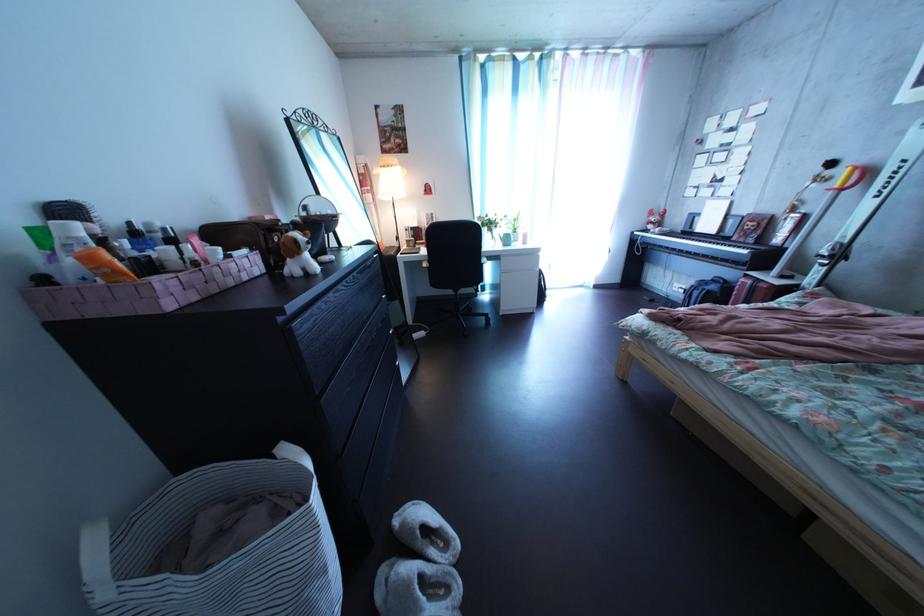
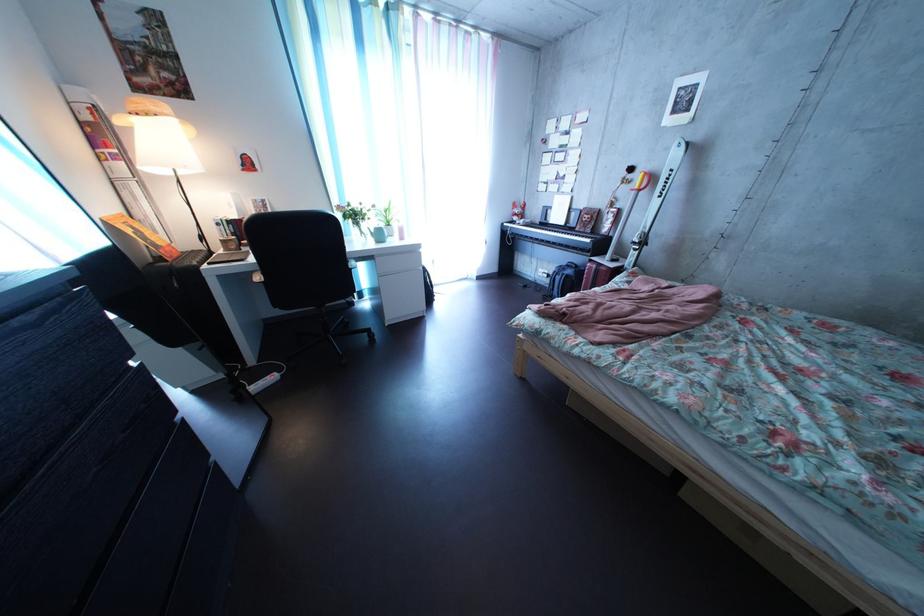
In the second image, find the point that corresponds to point (689, 293) in the first image.

(554, 278)